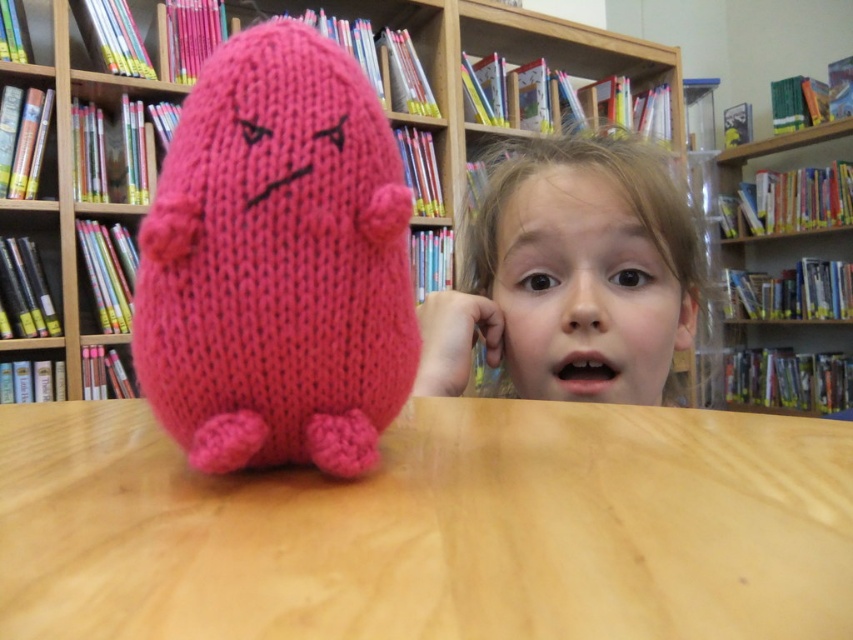
You are a photographer trying to capture a clear image of both the knitted pink plush at center and the matte pink plushie at center. Since you can only focus on one object at a time, which one should you focus on to ensure the other is still somewhat in focus?

You should focus on the knitted pink plush at center because it is closer to the viewer. By focusing on the closer object, the matte pink plushie at center, which is farther away, will still be somewhat in focus due to the depth of field.

You are a librarian organizing items in the library. You have a matte pink plushie at center and a wooden bookshelf at upper right. Which object is smaller in size?

The matte pink plushie at center is smaller in size compared to the wooden bookshelf at upper right.